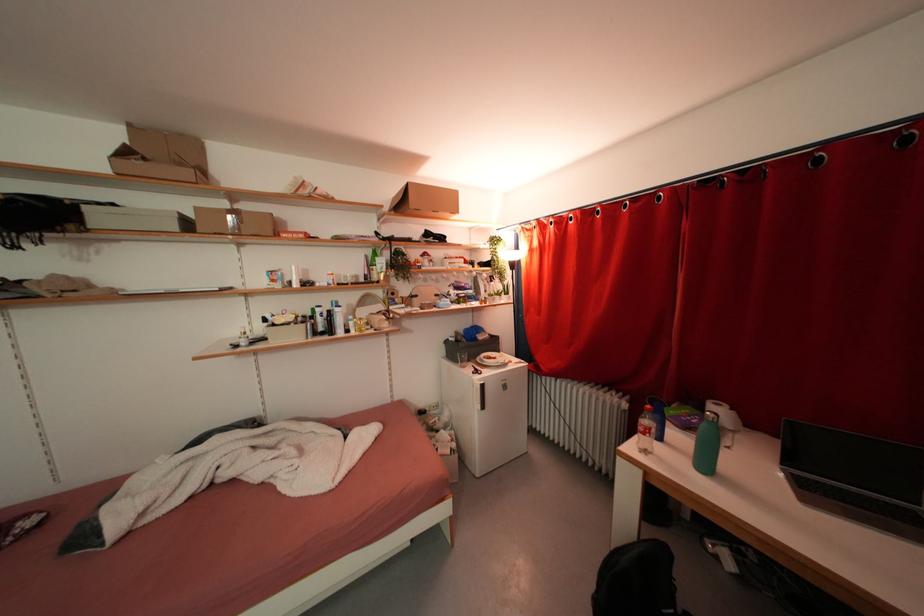
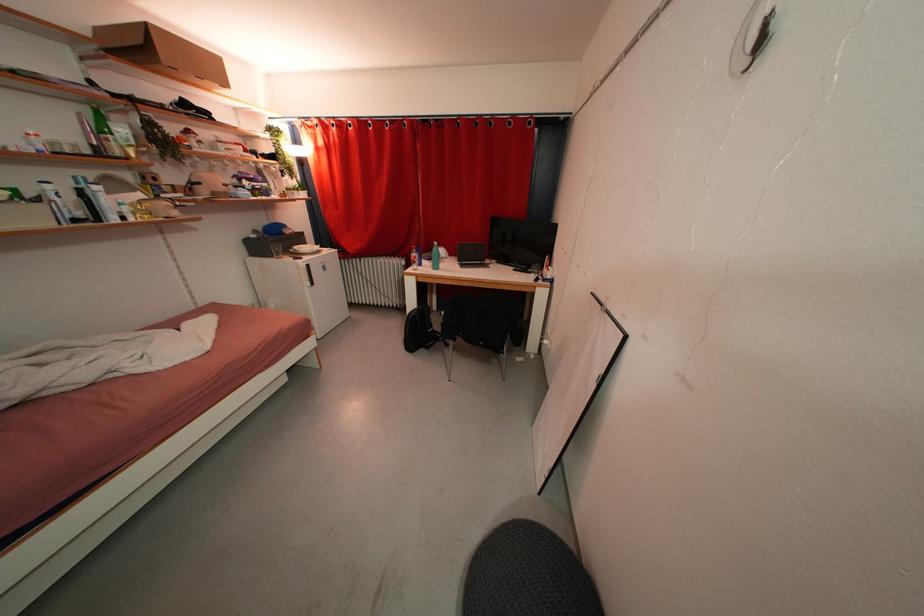
In the second image, find the point that corresponds to (x=453, y=205) in the first image.

(214, 71)